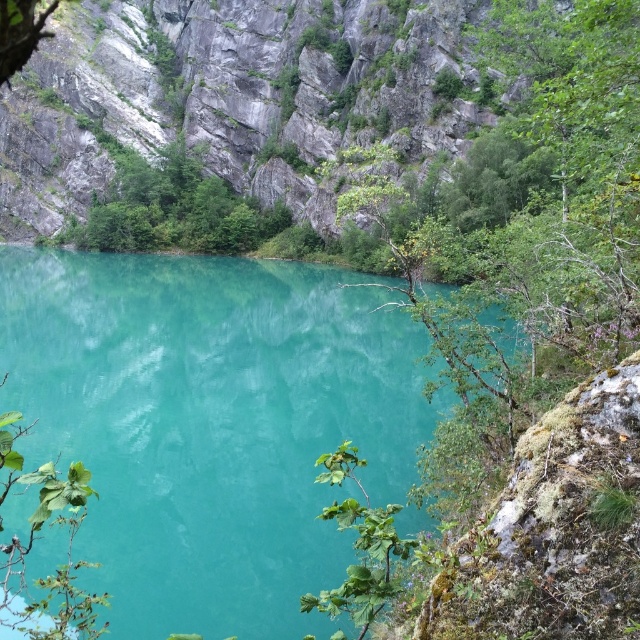
Does point (198, 172) come behind point (22, 628)?

Yes, point (198, 172) is behind point (22, 628).

You are a GUI agent. You are given a task and a screenshot of the screen. Output one action in this format:
    pyautogui.click(x=<x>, y=<y>)
    Task: Click on the green leafy tree at upper center
    
    Given the screenshot: What is the action you would take?
    pyautogui.click(x=173, y=208)

Does green leafy tree at center have a greater width compared to green leafy plant at lower right?

Indeed, green leafy tree at center has a greater width compared to green leafy plant at lower right.

Can you confirm if green leafy tree at center is shorter than green leafy plant at lower right?

No, green leafy tree at center is not shorter than green leafy plant at lower right.

Which is in front, point (40, 490) or point (332, 456)?

Point (40, 490) is more forward.

The image size is (640, 640). What are the coordinates of `green leafy tree at center` in the screenshot? It's located at (33, 540).

Who is positioned more to the right, turquoise glossy water at center or green leafy tree at upper center?

Positioned to the right is turquoise glossy water at center.

The image size is (640, 640). I want to click on turquoise glossy water at center, so click(211, 424).

Is point (33, 429) less distant than point (134, 204)?

Yes.

Identify the location of turquoise glossy water at center. (211, 424).